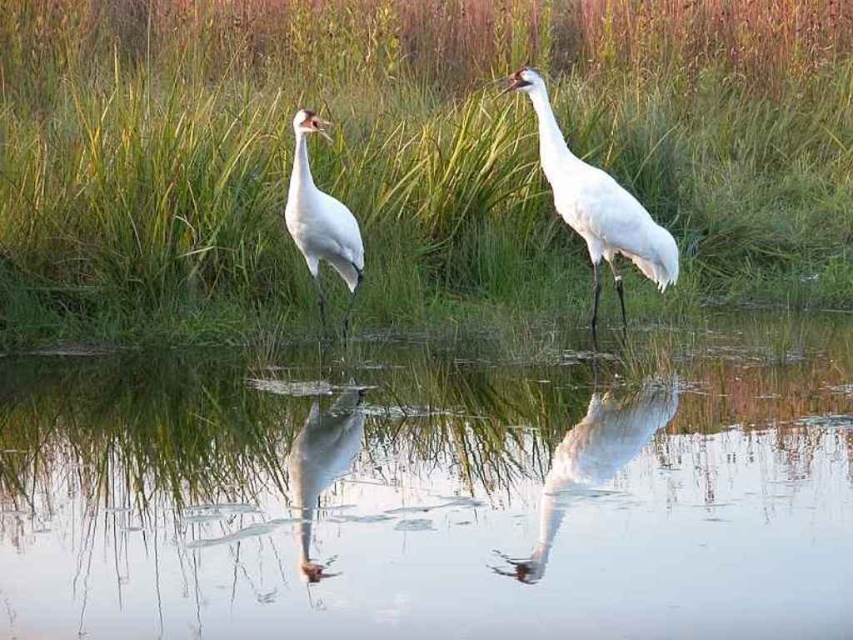
You are a photographer aiming to capture the reflection of the white feathered crane at left in the clear water at center. Given that your camera can focus on objects within 2 meters, will you be able to capture the reflection clearly?

The distance between the white feathered crane at left and the clear water at center is 1.83 meters, which is within the camera focus range of 2 meters. Therefore, you can capture the reflection clearly.